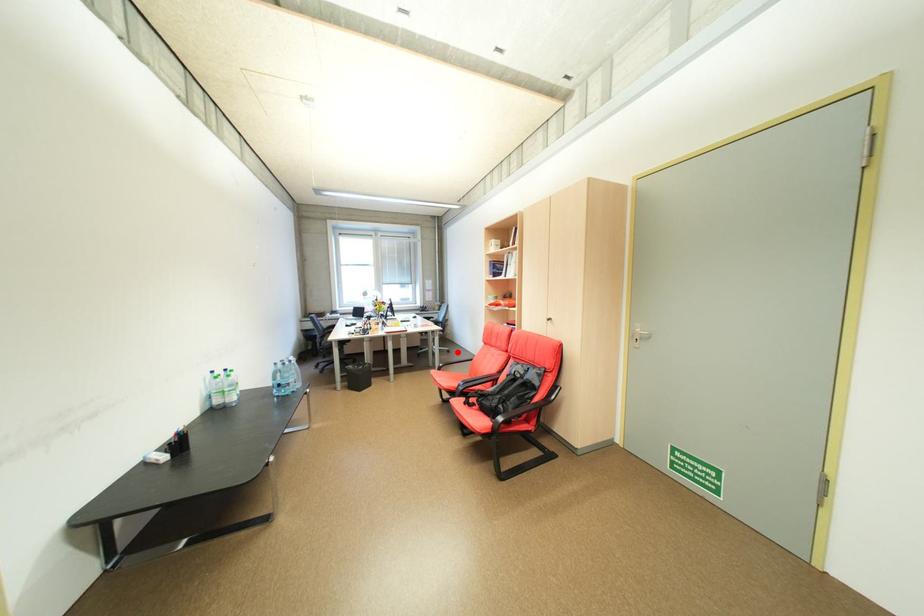
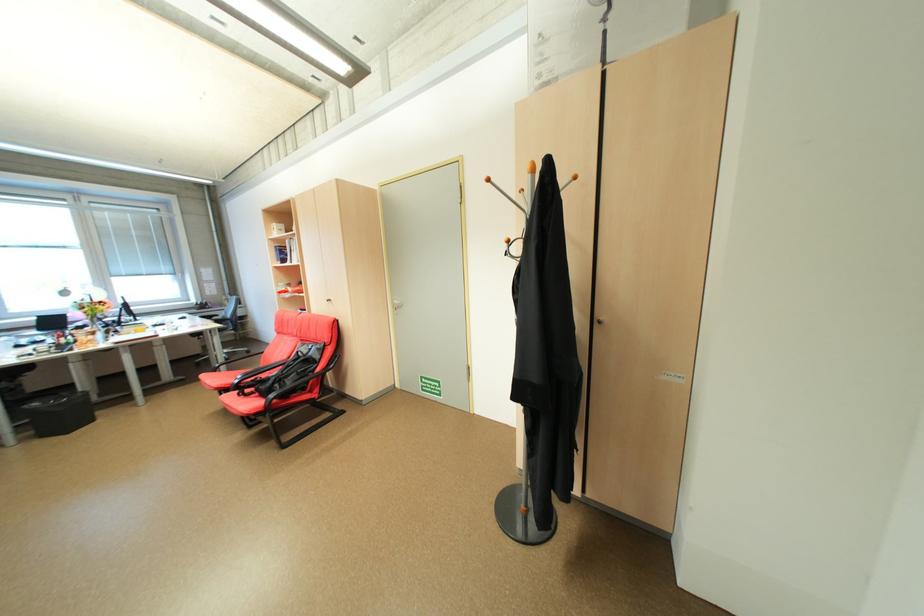
Locate, in the second image, the point that corresponds to the highlighted location in the first image.

(257, 353)